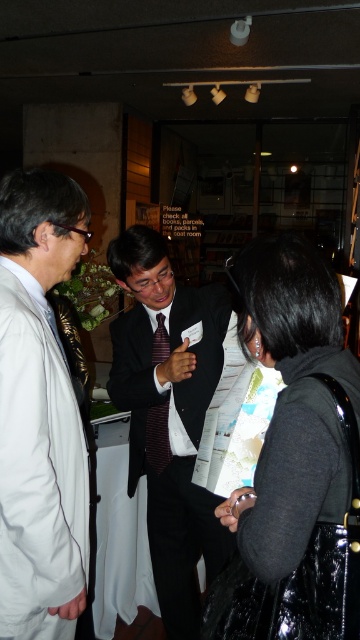
Question: Which object is farther from the camera taking this photo?

Choices:
 (A) striped silk tie at center
 (B) white matte coat at left

Answer: (A)

Question: Is the position of black shiny jacket at lower right more distant than that of matte black suit at center?

Choices:
 (A) no
 (B) yes

Answer: (A)

Question: Which is farther from the striped silk tie at center?

Choices:
 (A) black shiny jacket at lower right
 (B) white matte coat at left

Answer: (A)

Question: Is black shiny jacket at lower right to the left of striped silk tie at center from the viewer's perspective?

Choices:
 (A) yes
 (B) no

Answer: (B)

Question: Which of the following is the farthest from the observer?

Choices:
 (A) striped silk tie at center
 (B) black shiny jacket at lower right
 (C) white matte coat at left

Answer: (A)

Question: Does white matte coat at left come in front of matte black suit at center?

Choices:
 (A) yes
 (B) no

Answer: (A)